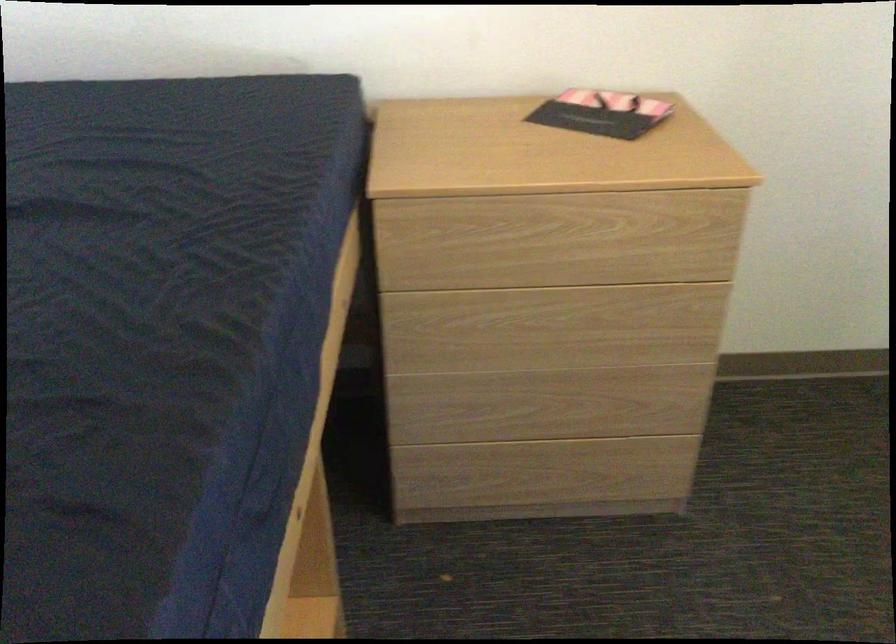
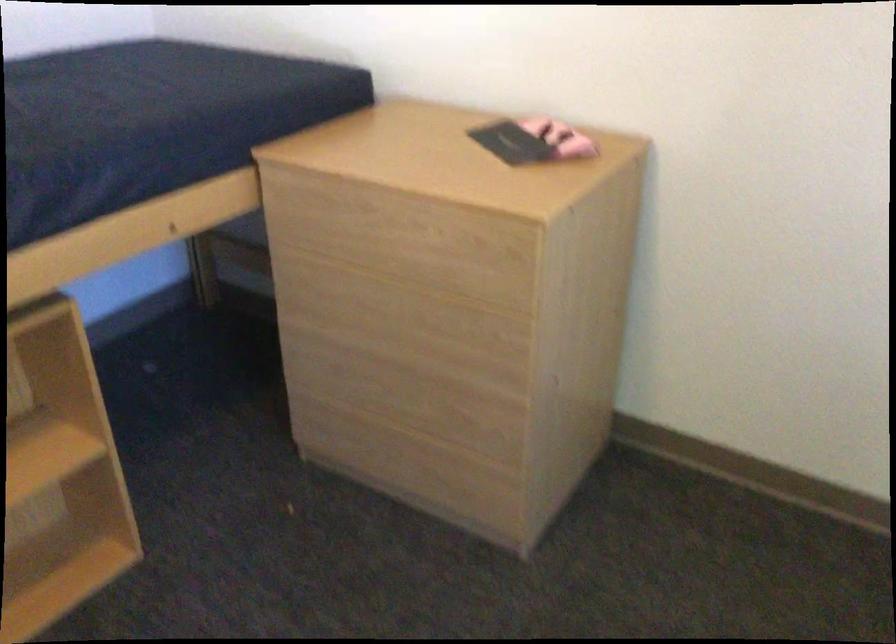
Find the pixel in the second image that matches (581,330) in the first image.

(410, 327)